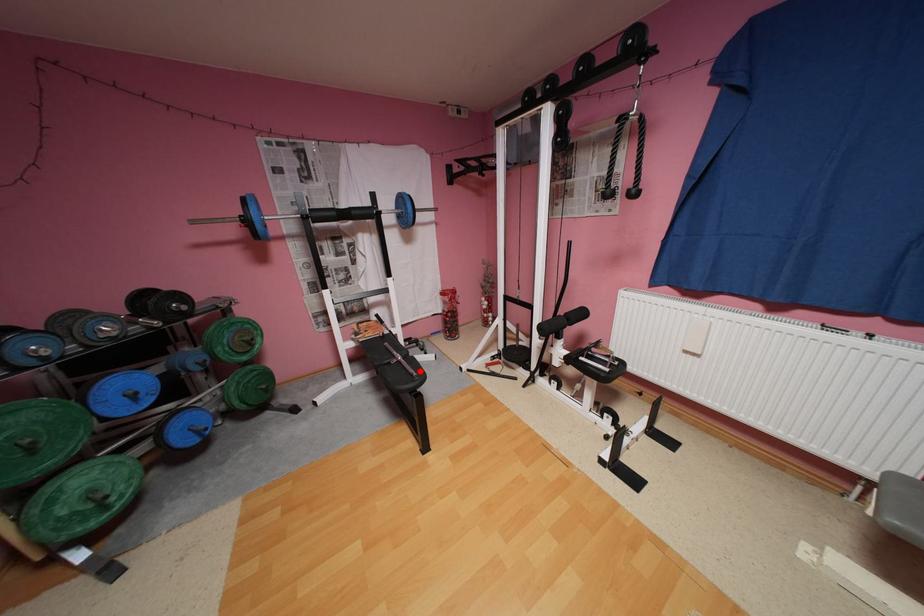
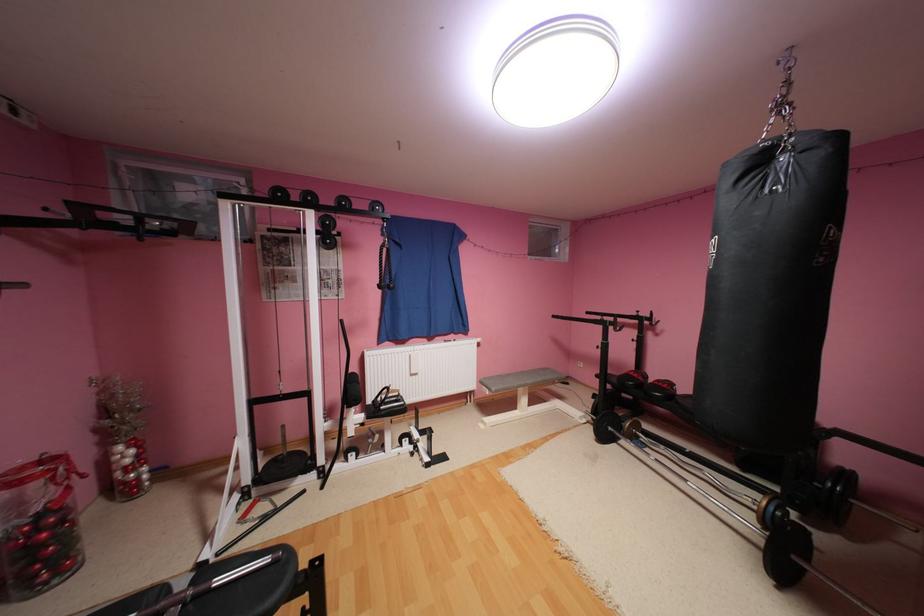
Where in the second image is the point corresponding to the highlighted location from the first image?

(276, 560)